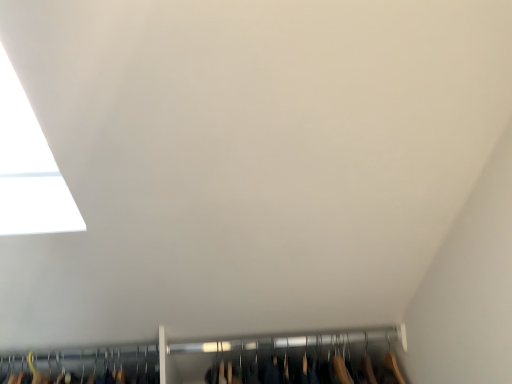
Where is `transparent glass window at upper left`? The image size is (512, 384). transparent glass window at upper left is located at coordinates (29, 168).

Describe the element at coordinates (29, 168) in the screenshot. I see `transparent glass window at upper left` at that location.

What is the approximate height of transparent glass window at upper left?

27.92 inches.

At what (x,y) coordinates should I click in order to perform the action: click on transparent glass window at upper left. Please return your answer as a coordinate pair (x, y). This screenshot has height=384, width=512. Looking at the image, I should click on 29,168.